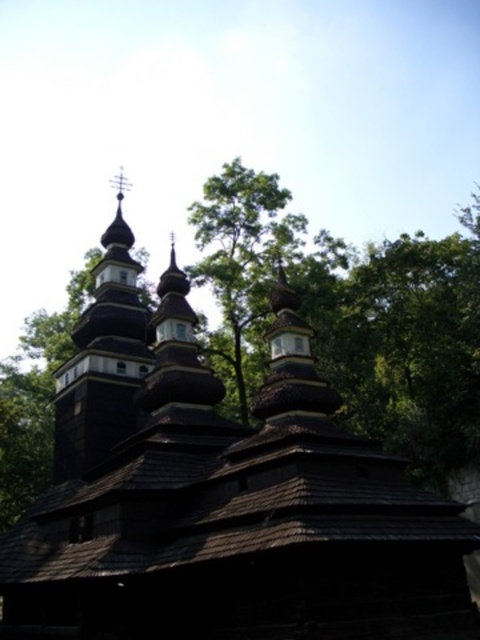
Is dark wood church at center wider than dark brown wooden tower at upper left?

Indeed, dark wood church at center has a greater width compared to dark brown wooden tower at upper left.

Is the position of dark wood church at center less distant than that of dark brown wooden tower at upper left?

Yes, dark wood church at center is closer to the viewer.

At what (x,y) coordinates should I click in order to perform the action: click on dark wood church at center. Please return your answer as a coordinate pair (x, y). Image resolution: width=480 pixels, height=640 pixels. Looking at the image, I should click on (219, 496).

I want to click on dark wood church at center, so click(x=219, y=496).